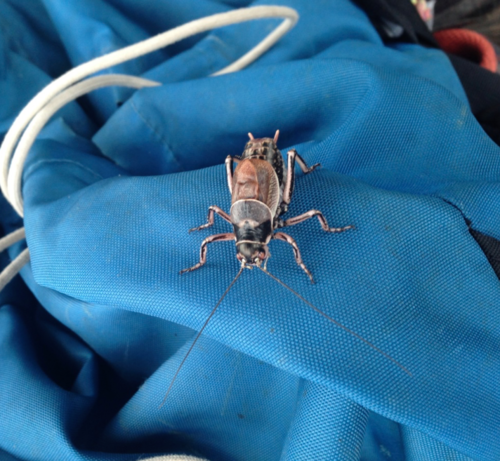
I want to click on white cord, so click(96, 62).